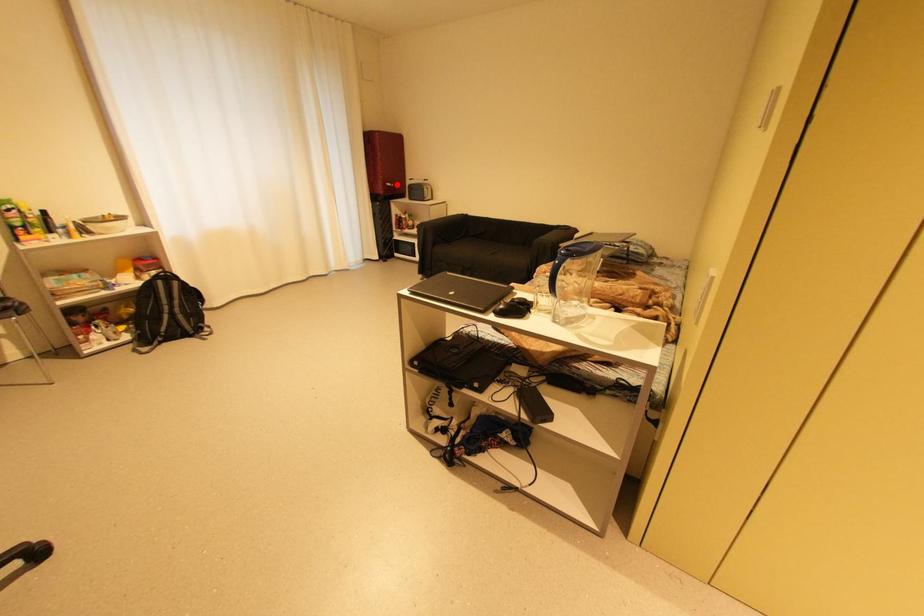
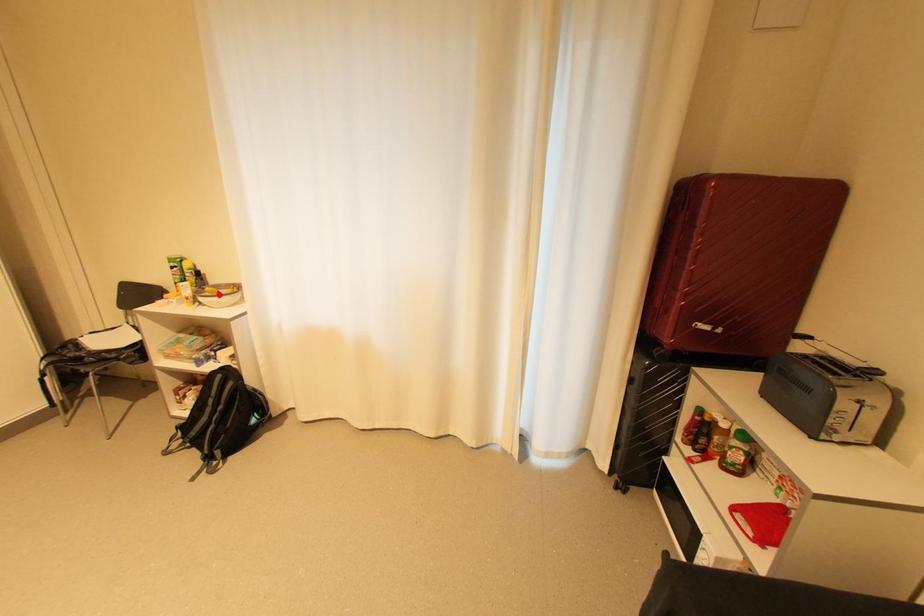
I am providing you with two images of the same scene from different viewpoints. A red point is marked on the first image and another point is marked on the second image. Does the point marked in image1 correspond to the same location as the one in image2?

No